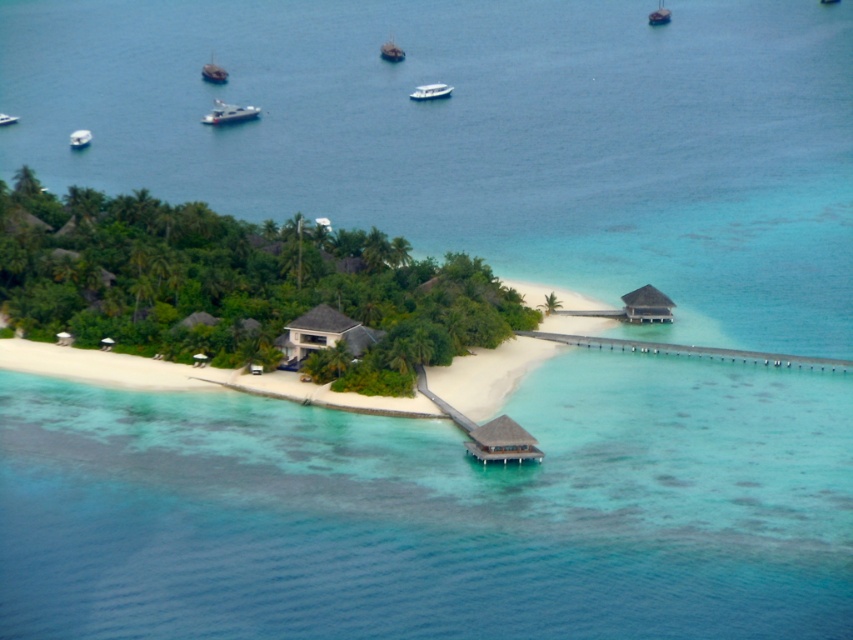
You are standing on the beach and want to reach the white glossy boat at center. The path to it goes through the matte brown hut at center. Is the boat closer to you or further away than the hut?

The matte brown hut at center is closer to the viewer than the white glossy boat at center, so the boat is further away than the hut.

You are a guest staying at the resort and want to know which of the two huts is taller. You can see the matte brown hut at center and the brown thatched hut at right from your balcony. Which one is taller?

The matte brown hut at center is taller than the brown thatched hut at right according to the description.